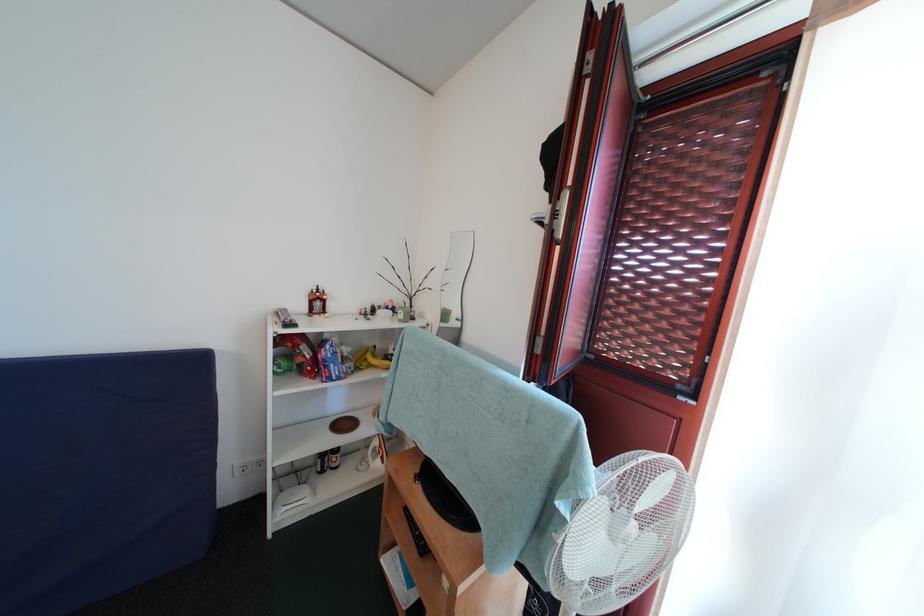
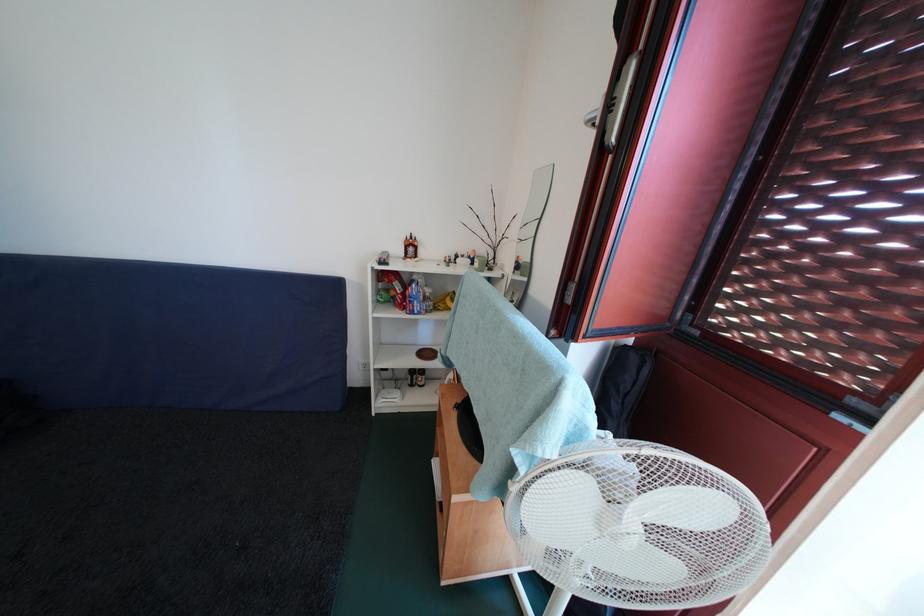
Find the pixel in the second image that matches [357,355] in the first image.

(438, 296)